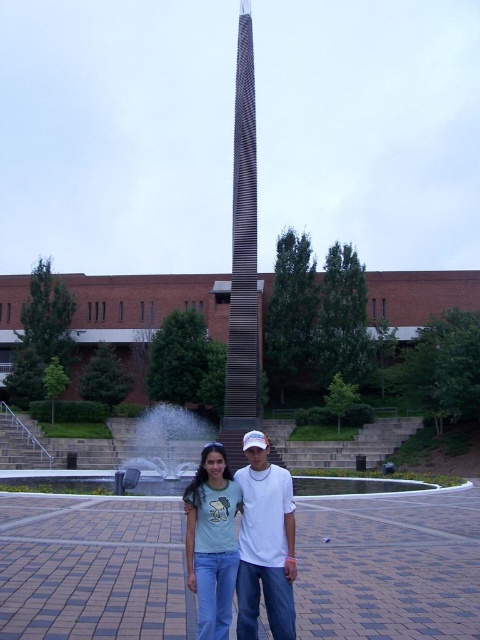
You are standing in front of the modern building and see the light blue jeans at center and the white glossy water at center. Which object is positioned to the right?

The light blue jeans at center is to the right of the white glossy water at center.

You are standing in front of a modern building with a carbon fiber tower at center. If you want to take a photo that includes both the tower and the two people in the foreground, how far back should you move to ensure they are all in frame?

The carbon fiber tower at center is 169.39 feet away from the viewer. To include both the tower and the two people in the foreground in the photo, you should move back approximately 169.39 feet to ensure all elements are in frame.